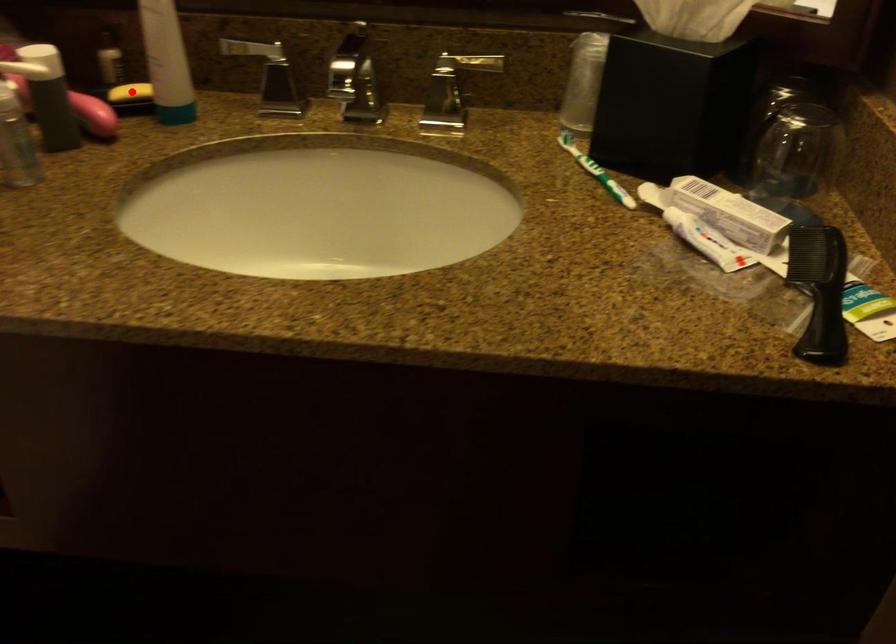
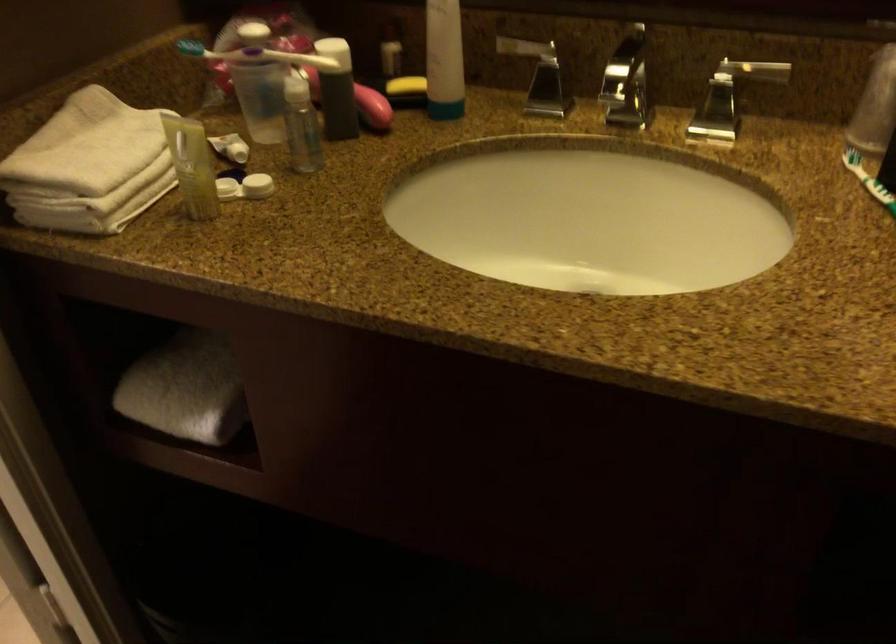
Where in the second image is the point corresponding to the highlighted location from the first image?

(406, 84)